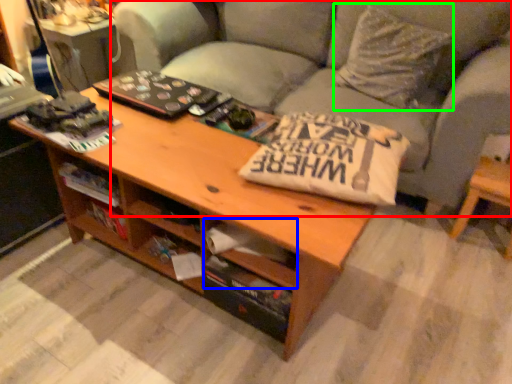
Question: Which object is the farthest from studio couch (highlighted by a red box)? Choose among these: drawer (highlighted by a blue box) or throw pillow (highlighted by a green box).

Choices:
 (A) drawer
 (B) throw pillow

Answer: (A)